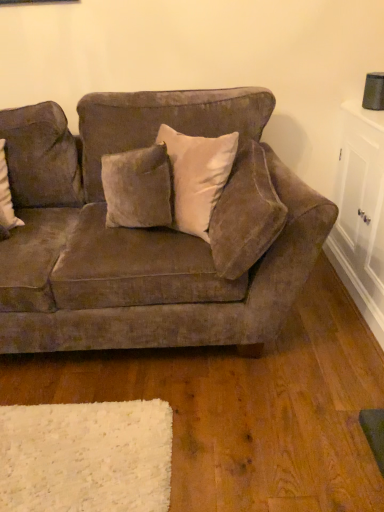
Question: From a real-world perspective, is white glossy cabinet at right located higher than velvet brown couch at center?

Choices:
 (A) no
 (B) yes

Answer: (A)

Question: Is white glossy cabinet at right not within velvet brown couch at center?

Choices:
 (A) no
 (B) yes

Answer: (B)

Question: From the image's perspective, is white glossy cabinet at right beneath velvet brown couch at center?

Choices:
 (A) yes
 (B) no

Answer: (B)

Question: From a real-world perspective, is white glossy cabinet at right located beneath velvet brown couch at center?

Choices:
 (A) no
 (B) yes

Answer: (B)

Question: Is velvet brown couch at center surrounded by white glossy cabinet at right?

Choices:
 (A) yes
 (B) no

Answer: (B)

Question: Is the surface of white glossy cabinet at right in direct contact with velvet brown couch at center?

Choices:
 (A) yes
 (B) no

Answer: (B)

Question: Considering the relative sizes of velvet brown couch at center and velvet beige pillow at upper center in the image provided, is velvet brown couch at center taller than velvet beige pillow at upper center?

Choices:
 (A) yes
 (B) no

Answer: (A)

Question: Is velvet brown couch at center closer to camera compared to velvet beige pillow at upper center?

Choices:
 (A) no
 (B) yes

Answer: (A)

Question: Is velvet brown couch at center positioned far away from velvet beige pillow at upper center?

Choices:
 (A) no
 (B) yes

Answer: (A)

Question: Does velvet brown couch at center appear on the left side of velvet beige pillow at upper center?

Choices:
 (A) yes
 (B) no

Answer: (A)

Question: From the image's perspective, is velvet brown couch at center over velvet beige pillow at upper center?

Choices:
 (A) yes
 (B) no

Answer: (B)

Question: Does velvet brown couch at center have a larger size compared to velvet beige pillow at upper center?

Choices:
 (A) no
 (B) yes

Answer: (B)

Question: Considering the relative positions of velvet beige pillow at upper center and white glossy cabinet at right in the image provided, is velvet beige pillow at upper center to the right of white glossy cabinet at right from the viewer's perspective?

Choices:
 (A) yes
 (B) no

Answer: (B)